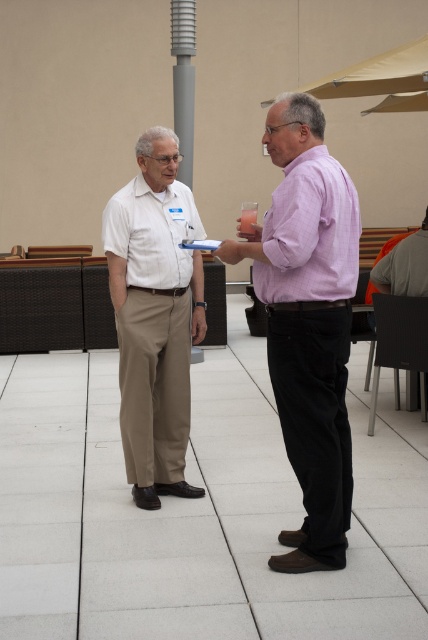
Question: Considering the real-world distances, which object is closest to the light beige cotton pants at left?

Choices:
 (A) purple cotton shirt at center
 (B) purple cotton shirt at right

Answer: (B)

Question: Considering the relative positions of light beige cotton pants at left and purple cotton shirt at center in the image provided, where is light beige cotton pants at left located with respect to purple cotton shirt at center?

Choices:
 (A) right
 (B) left

Answer: (B)

Question: Which point is farther to the camera?

Choices:
 (A) (175, 344)
 (B) (318, 212)

Answer: (A)

Question: Which point is farther to the camera?

Choices:
 (A) white matte shirt at center
 (B) purple cotton shirt at right
 (C) purple cotton shirt at center

Answer: (A)

Question: Is purple cotton shirt at right closer to the viewer compared to white matte shirt at center?

Choices:
 (A) yes
 (B) no

Answer: (A)

Question: Can you confirm if purple cotton shirt at right is smaller than light beige cotton pants at left?

Choices:
 (A) yes
 (B) no

Answer: (B)